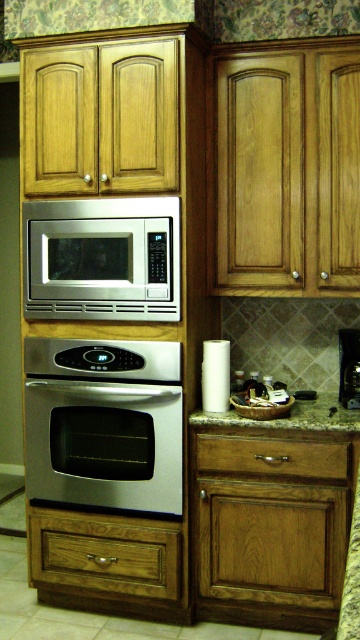
Question: From the image, what is the correct spatial relationship of wooden drawer at lower left in relation to satin silver microwave at upper center?

Choices:
 (A) right
 (B) left

Answer: (B)

Question: Which is nearer to the satin silver microwave at upper center?

Choices:
 (A) wooden drawer at lower left
 (B) wooden drawer at lower center
 (C) granite countertop at lower center
 (D) stainless steel microwave at center

Answer: (C)

Question: Which of the following is the closest to the observer?

Choices:
 (A) (105, 556)
 (B) (241, 564)
 (C) (119, 493)

Answer: (B)

Question: In this image, where is granite/stone countertop at lower center located relative to satin silver microwave at upper center?

Choices:
 (A) below
 (B) above

Answer: (A)

Question: Is stainless steel oven at center above granite countertop at lower center?

Choices:
 (A) no
 (B) yes

Answer: (A)

Question: Among these points, which one is nearest to the camera?

Choices:
 (A) pos(340,408)
 (B) pos(52,472)
 (C) pos(47,205)

Answer: (C)